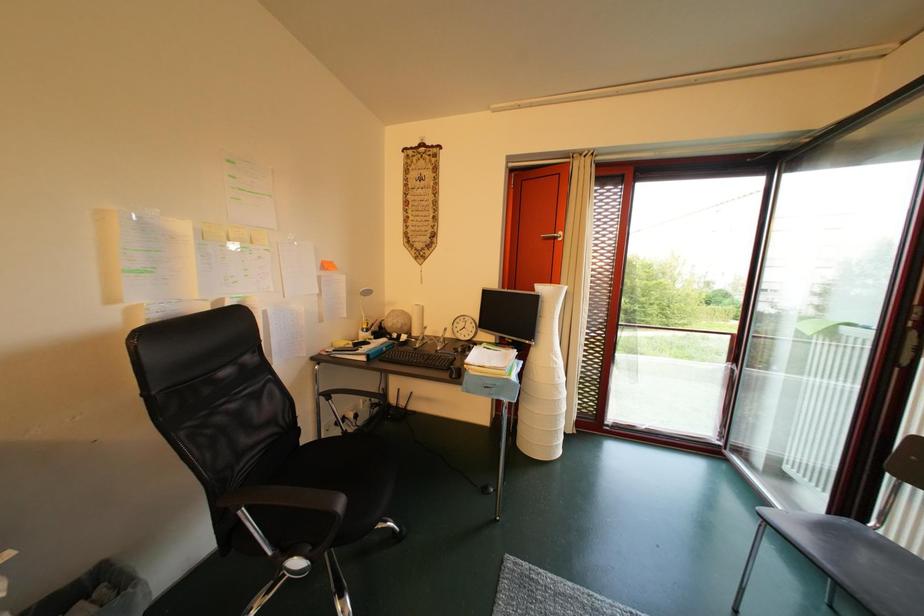
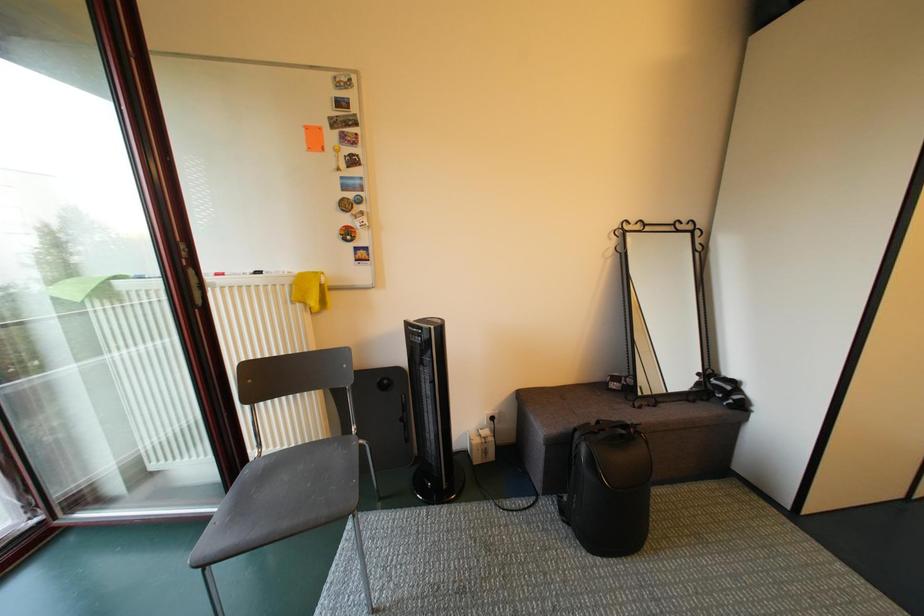
Based on the continuous images, in which direction is the camera rotating?

The camera's rotation is toward right-down.